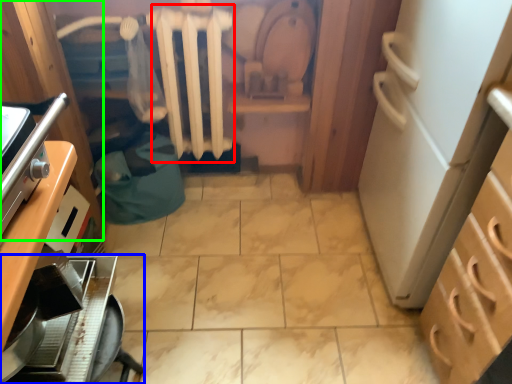
Question: Which object is positioned closest to radiator (highlighted by a red box)? Select from kitchen appliance (highlighted by a blue box) and cabinetry (highlighted by a green box).

Choices:
 (A) kitchen appliance
 (B) cabinetry

Answer: (B)